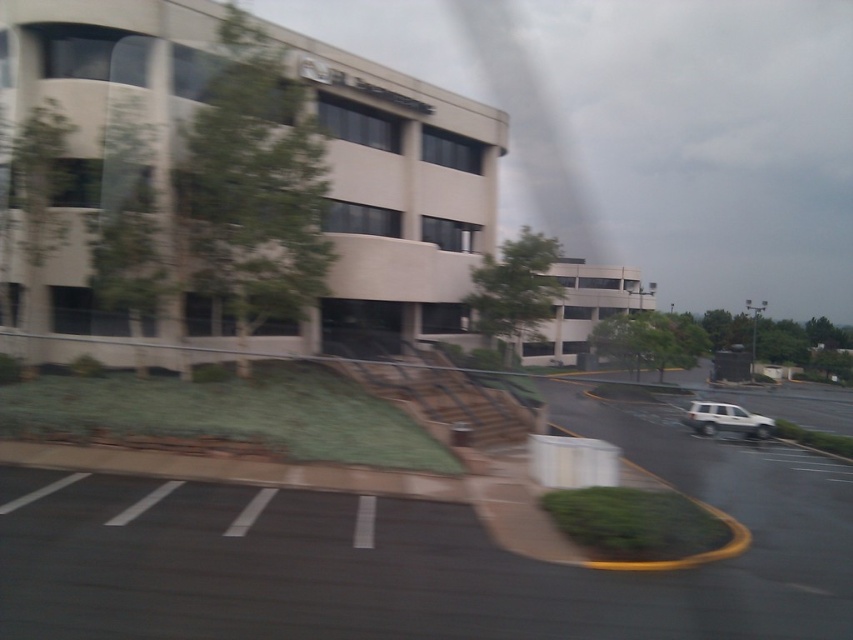
Question: Is black asphalt parking lot at lower left thinner than white matte suv at lower right?

Choices:
 (A) no
 (B) yes

Answer: (A)

Question: Can you confirm if black asphalt parking lot at lower left is positioned below white matte suv at lower right?

Choices:
 (A) yes
 (B) no

Answer: (B)

Question: Which point appears closest to the camera in this image?

Choices:
 (A) (80, 554)
 (B) (724, 403)

Answer: (A)

Question: Is black asphalt parking lot at lower left smaller than white matte suv at lower right?

Choices:
 (A) yes
 (B) no

Answer: (B)